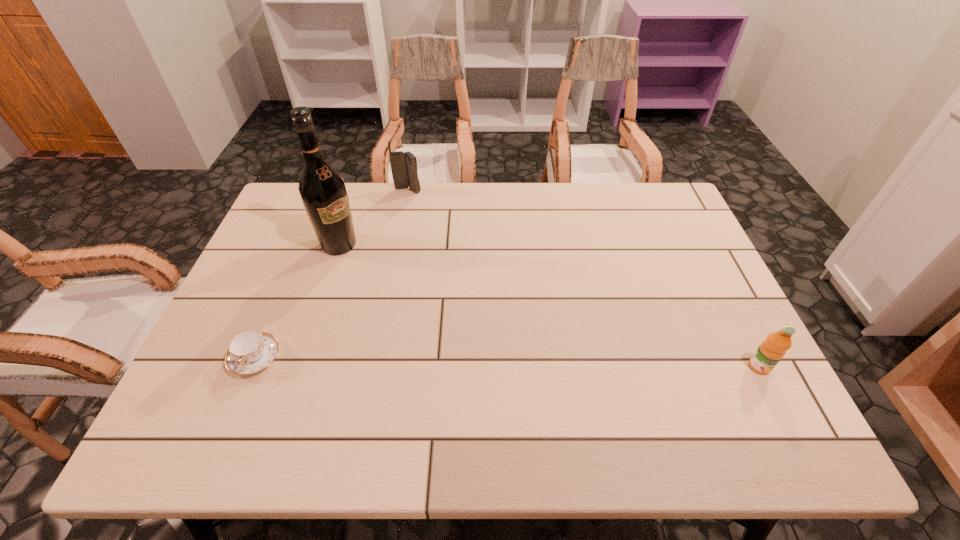
At what (x,y) coordinates should I click in order to perform the action: click on teacup. Please return your answer as a coordinate pair (x, y). The height and width of the screenshot is (540, 960). Looking at the image, I should click on click(x=250, y=351).

The image size is (960, 540). In order to click on the third tallest object in this screenshot , I will do (x=771, y=351).

Locate an element on the screen. This screenshot has width=960, height=540. orange juice is located at coordinates (771, 351).

Where is `wine bottle`? This screenshot has width=960, height=540. wine bottle is located at coordinates (322, 189).

This screenshot has width=960, height=540. I want to click on the tallest object, so click(x=322, y=189).

Identify the location of the second tallest object. The width and height of the screenshot is (960, 540). (403, 164).

In order to click on cellular telephone in this screenshot , I will do `click(403, 164)`.

This screenshot has height=540, width=960. I want to click on vacant space located on the side with the handle of the shortest object, so click(236, 405).

Find the location of a particular element. The width and height of the screenshot is (960, 540). vacant space located on the label of the wine bottle is located at coordinates (441, 313).

The width and height of the screenshot is (960, 540). Identify the location of free space located on the label of the wine bottle. (392, 280).